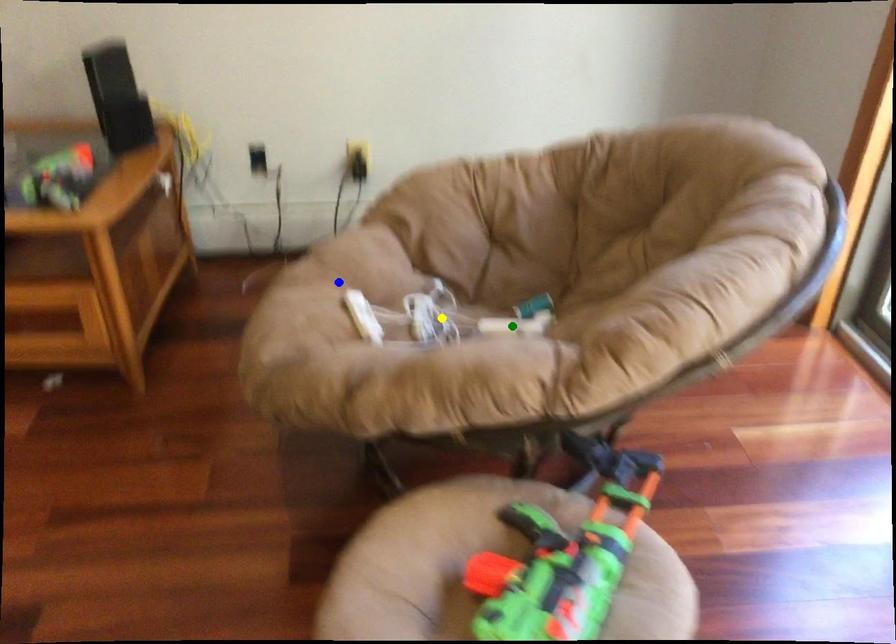
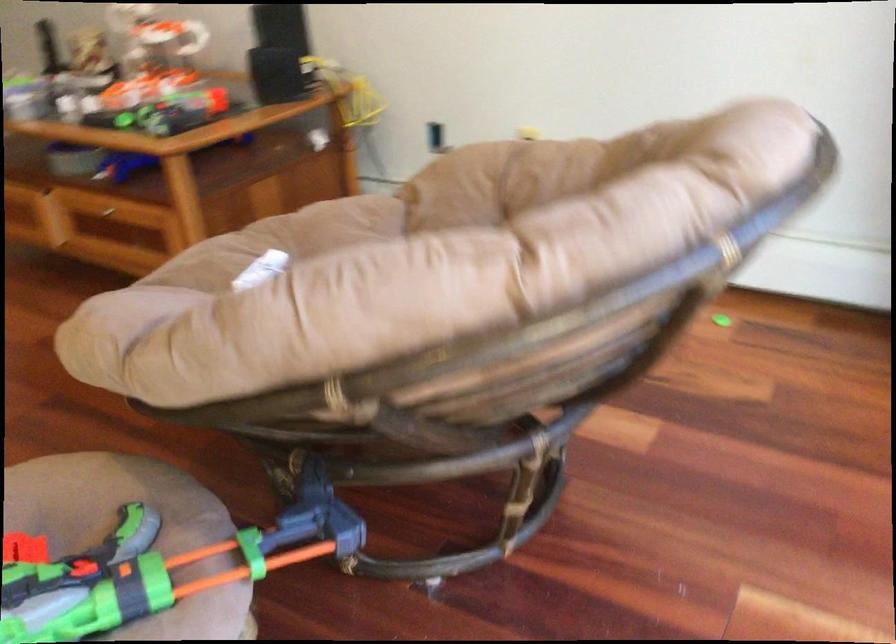
I am providing you with two images of the same scene from different viewpoints. Three points are marked in image1. Which point corresponds to a part or object that is occluded in image2?In image1, three points are marked. Which of them correspond to a part or object that is occluded in image2?Among the three points shown in image1, which one corresponds to a part or object that is no longer visible due to occlusion in image2?

Invisible in image2: yellow point, green point.